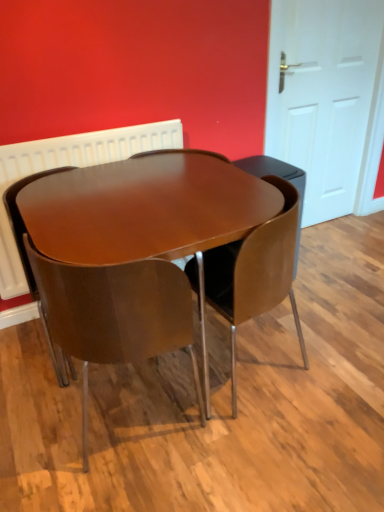
At what (x,y) coordinates should I click in order to perform the action: click on free point in front of glossy wood table at center. Please return your answer as a coordinate pair (x, y). Looking at the image, I should click on (189, 466).